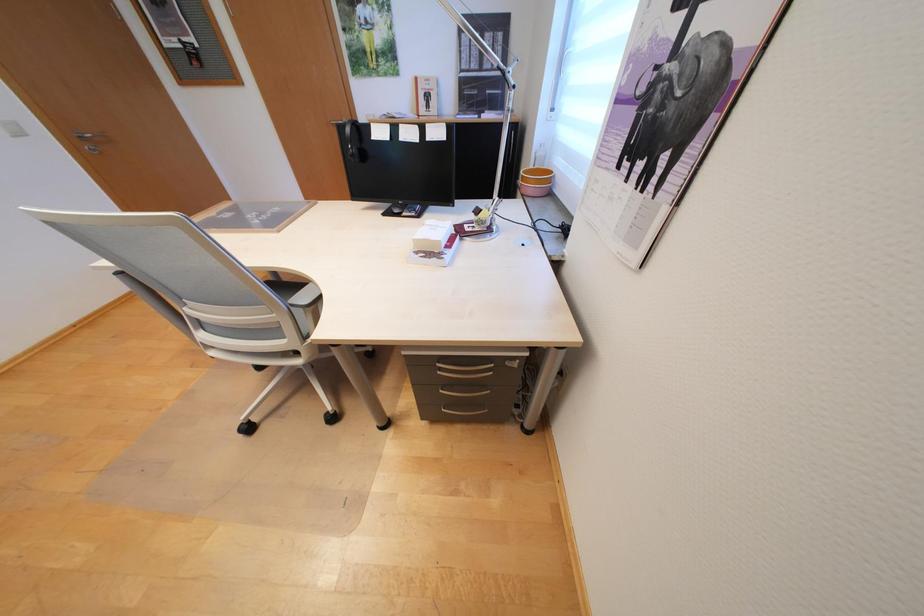
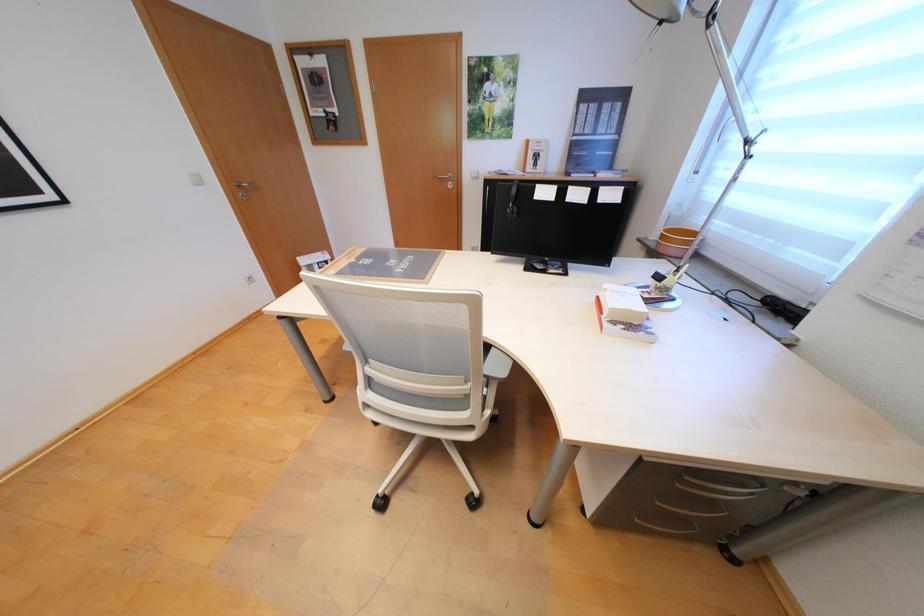
Question: What movement of the cameraman would produce the second image?

Choices:
 (A) Left
 (B) Right
 (C) Forward
 (D) Backward

Answer: (A)